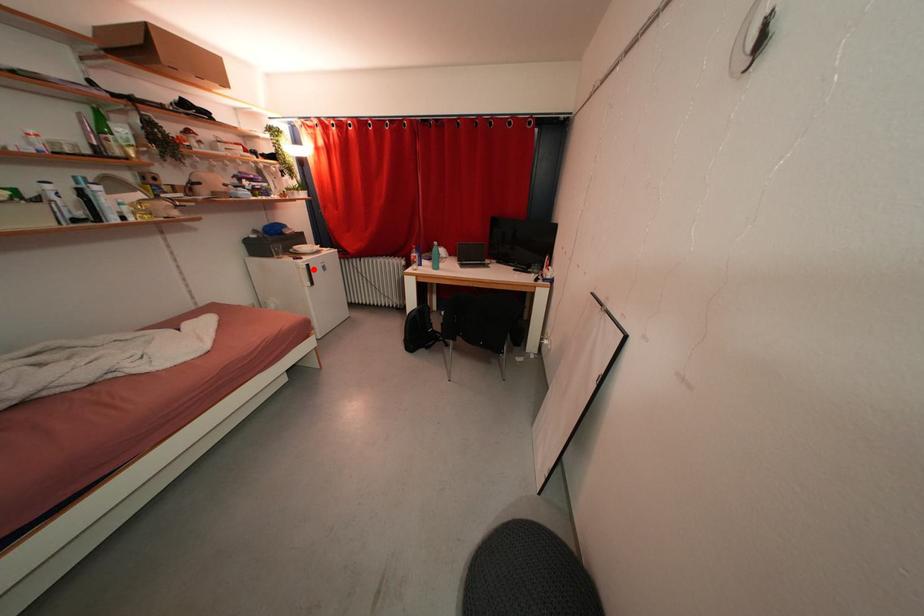
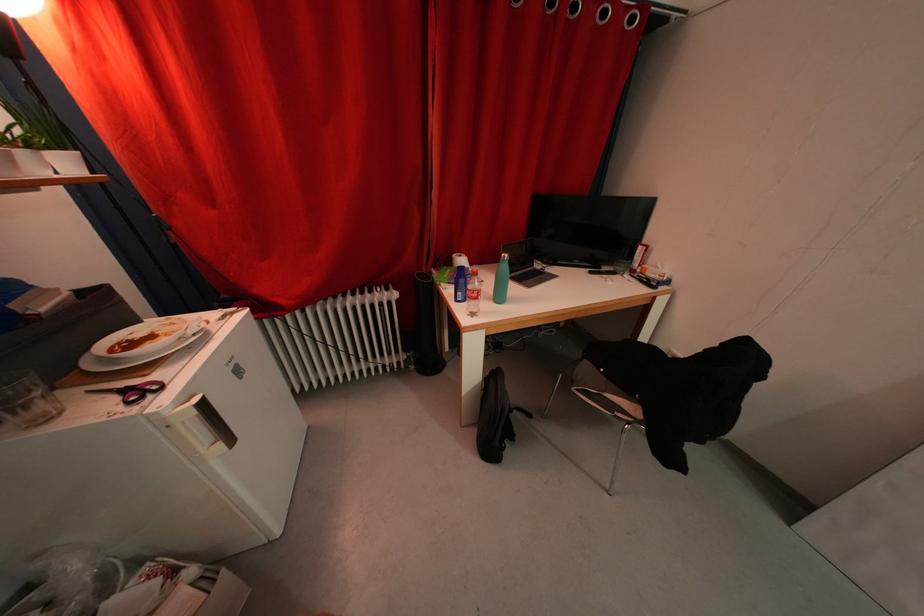
In the second image, find the point that corresponds to the highlighted location in the first image.

(209, 408)